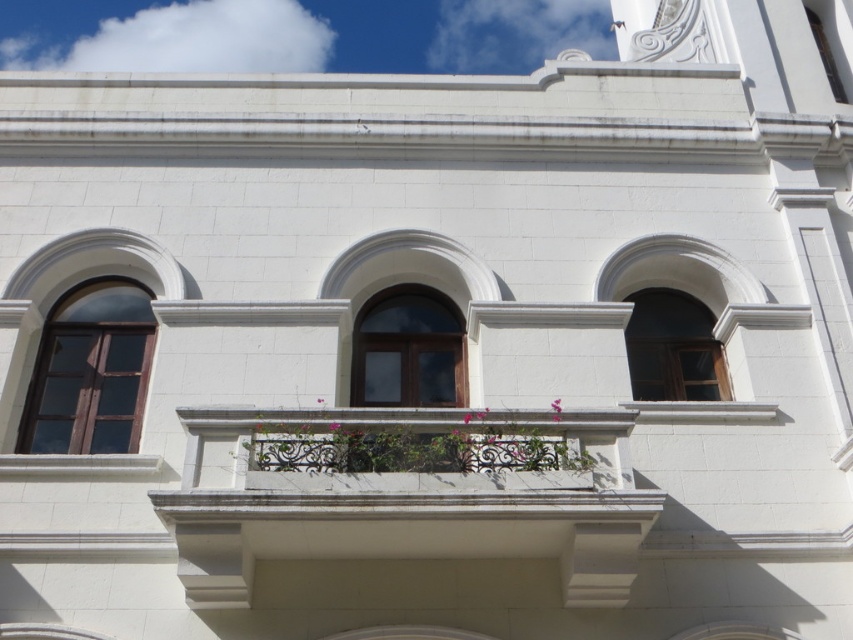
Is white stone balcony at center further to the viewer compared to pink matte flower at center?

That is False.

Can you confirm if white stone balcony at center is positioned above pink matte flower at center?

No.

The height and width of the screenshot is (640, 853). What are the coordinates of `white stone balcony at center` in the screenshot? It's located at point(404,493).

Who is positioned more to the left, wooden window at center or pink fabric flower at center?

Positioned to the left is pink fabric flower at center.

You are a GUI agent. You are given a task and a screenshot of the screen. Output one action in this format:
    pyautogui.click(x=<x>, y=<y>)
    Task: Click on the wooden window at center
    The image size is (853, 640).
    Given the screenshot: What is the action you would take?
    pyautogui.click(x=672, y=348)

Which of these two, white stone balcony at center or pink fabric flower at center, stands shorter?

pink fabric flower at center

Which is more to the left, white stone balcony at center or pink fabric flower at center?

From the viewer's perspective, white stone balcony at center appears more on the left side.

Where is `white stone balcony at center`? The width and height of the screenshot is (853, 640). white stone balcony at center is located at coordinates (404, 493).